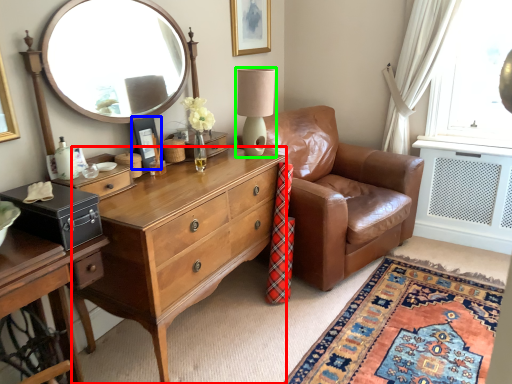
Question: Based on their relative distances, which object is farther from desk (highlighted by a red box)? Choose from picture frame (highlighted by a blue box) and table lamp (highlighted by a green box).

Choices:
 (A) picture frame
 (B) table lamp

Answer: (B)